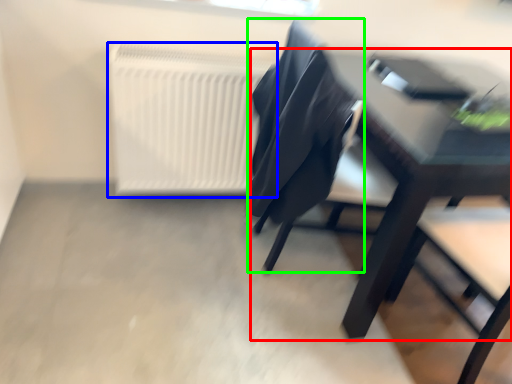
Question: Considering the real-world distances, which object is closest to table (highlighted by a red box)? radiator (highlighted by a blue box) or chair (highlighted by a green box).

Choices:
 (A) radiator
 (B) chair

Answer: (B)